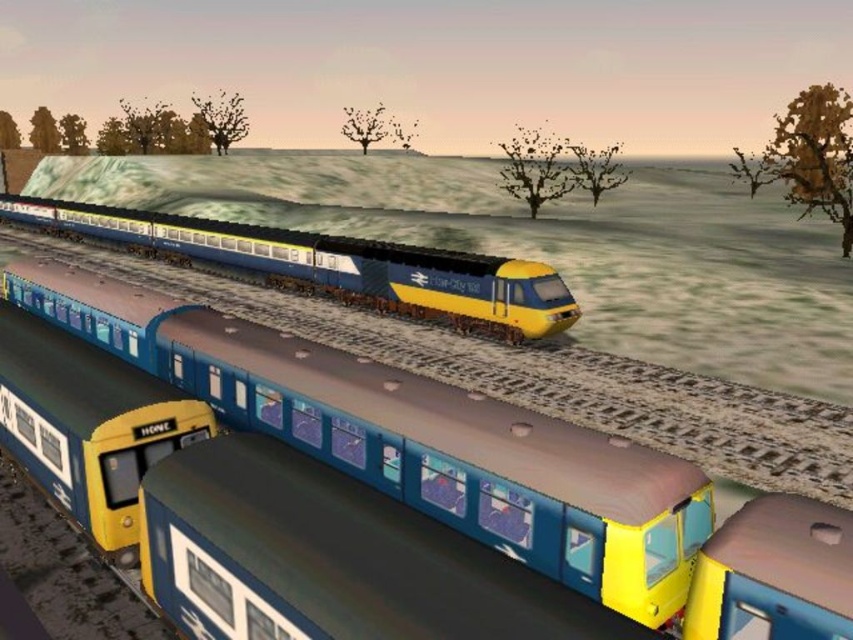
The height and width of the screenshot is (640, 853). What do you see at coordinates (474, 461) in the screenshot?
I see `metallic blue train at center` at bounding box center [474, 461].

Is metallic blue train at center positioned at the back of blue glossy train at center?

No, metallic blue train at center is closer to the viewer.

Between point (563, 493) and point (221, 220), which one is positioned behind?

The point (221, 220) is behind.

The height and width of the screenshot is (640, 853). I want to click on metallic blue train at center, so click(474, 461).